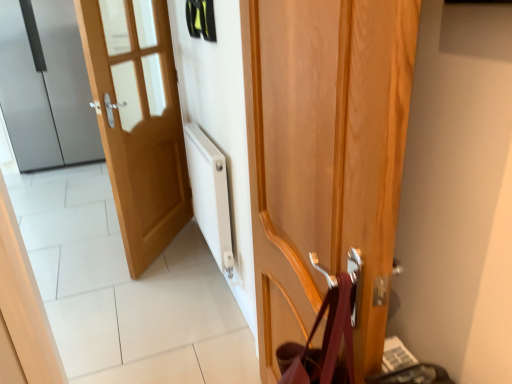
This screenshot has width=512, height=384. I want to click on free space to the left of light wood door at left, which appears as the 2th door when viewed from the back, so click(x=95, y=253).